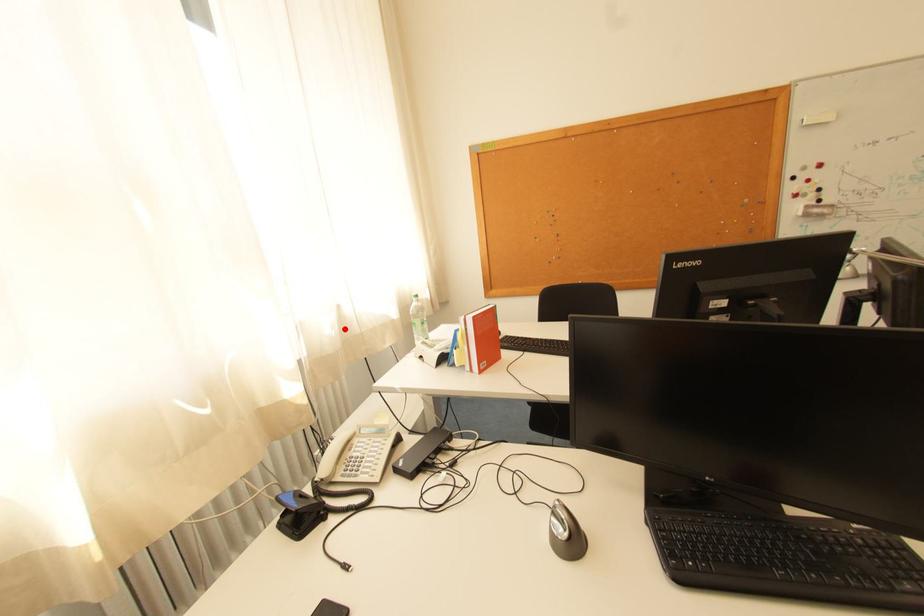
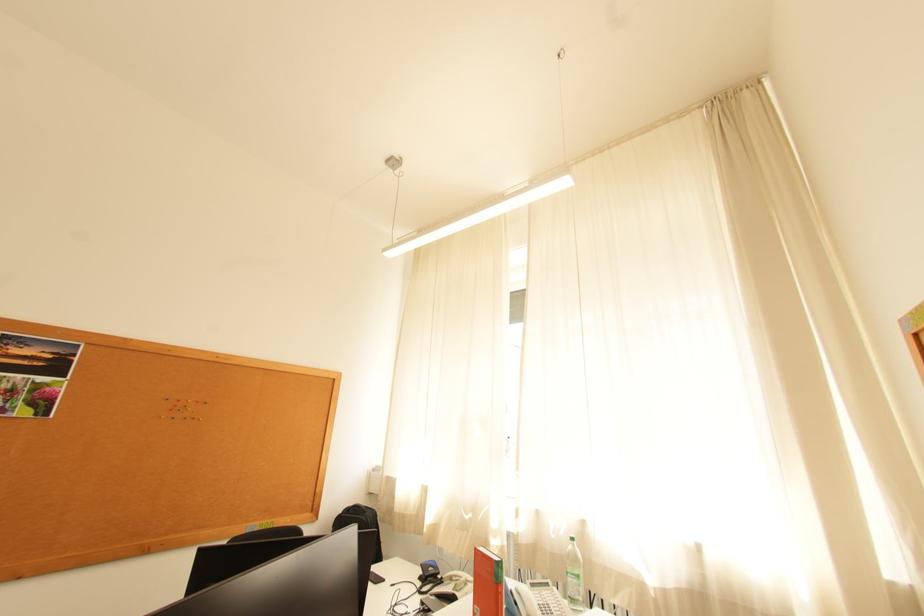
The point at the highlighted location is marked in the first image. Where is the corresponding point in the second image?

(569, 536)